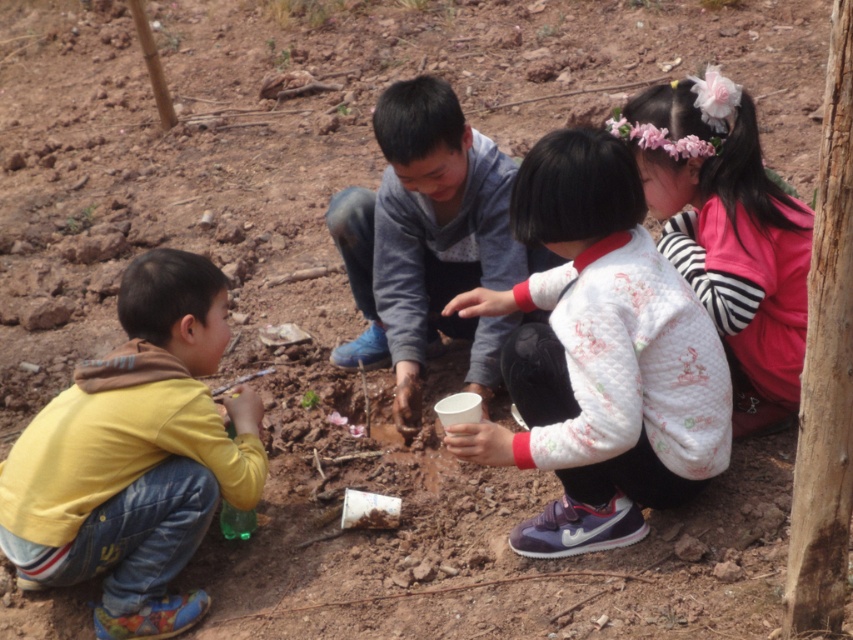
Can you confirm if white quilted sweater at center is shorter than yellow cotton shirt at lower left?

No, white quilted sweater at center is not shorter than yellow cotton shirt at lower left.

Identify the location of white quilted sweater at center. The height and width of the screenshot is (640, 853). (601, 356).

Can you confirm if white quilted sweater at center is shorter than fluffy pink hairband at upper right?

No, white quilted sweater at center is not shorter than fluffy pink hairband at upper right.

Can you confirm if white quilted sweater at center is taller than fluffy pink hairband at upper right?

Indeed, white quilted sweater at center has a greater height compared to fluffy pink hairband at upper right.

Who is more distant from viewer, (682,497) or (654,163)?

Positioned behind is point (654,163).

The image size is (853, 640). Find the location of `white quilted sweater at center`. white quilted sweater at center is located at coordinates (601, 356).

Looking at this image, can you confirm if dirty clay hands at center is taller than fluffy pink hairband at upper right?

Yes.

Is point (396, 291) more distant than point (735, 195)?

Yes, point (396, 291) is behind point (735, 195).

Who is more distant from viewer, (x=413, y=349) or (x=746, y=141)?

The point (x=413, y=349) is more distant.

Locate an element on the screen. This screenshot has width=853, height=640. dirty clay hands at center is located at coordinates (428, 241).